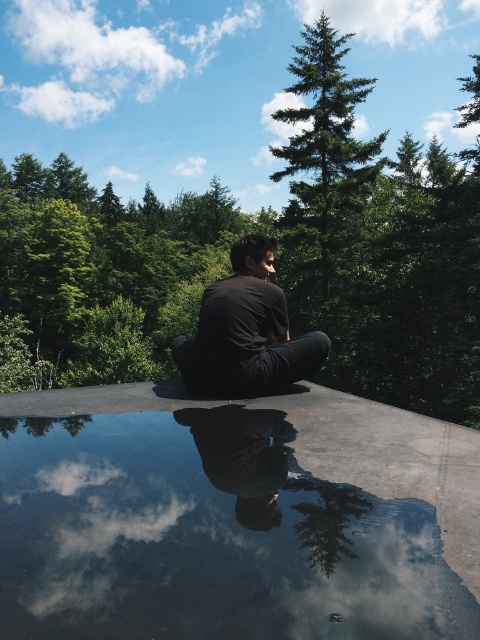
In the scene shown: Who is more forward, (160,388) or (212,371)?

Point (212,371) is in front.

Is glossy reflective water at center shorter than black matte shirt at center?

Correct, glossy reflective water at center is not as tall as black matte shirt at center.

The image size is (480, 640). What do you see at coordinates (233, 516) in the screenshot?
I see `glossy reflective water at center` at bounding box center [233, 516].

I want to click on glossy reflective water at center, so click(x=233, y=516).

Is green leafy tree at upper center to the right of black glossy pants at center from the viewer's perspective?

Indeed, green leafy tree at upper center is positioned on the right side of black glossy pants at center.

Between green leafy tree at upper center and black glossy pants at center, which one has more height?

green leafy tree at upper center is taller.

Locate an element on the screen. The width and height of the screenshot is (480, 640). green leafy tree at upper center is located at coordinates (324, 160).

Find the location of a particular element. green leafy tree at upper center is located at coordinates (324, 160).

From the picture: Can you confirm if green leafy tree at upper center is shorter than black matte shirt at center?

Incorrect, green leafy tree at upper center's height does not fall short of black matte shirt at center's.

Does point (339, 65) come behind point (236, 285)?

Yes, it is behind point (236, 285).

The height and width of the screenshot is (640, 480). Find the location of `green leafy tree at upper center`. green leafy tree at upper center is located at coordinates (324, 160).